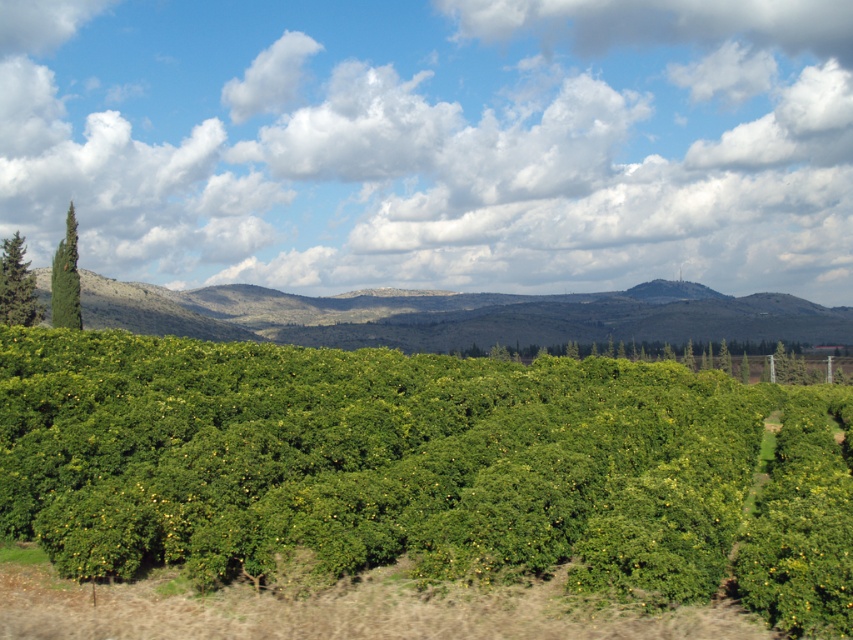
You are a gardener planning to trim the green leafy hedge at center and the green textured tree at upper left. Based on their heights, which one requires a taller ladder?

The green textured tree at upper left requires a taller ladder because it is taller than the green leafy hedge at center.

You are a farmer walking through the orange grove and looking at the green leafy hillside at center and the green textured tree at upper left. Which object is located lower in the image?

The green leafy hillside at center is positioned under the green textured tree at upper left, so it is lower in the image.